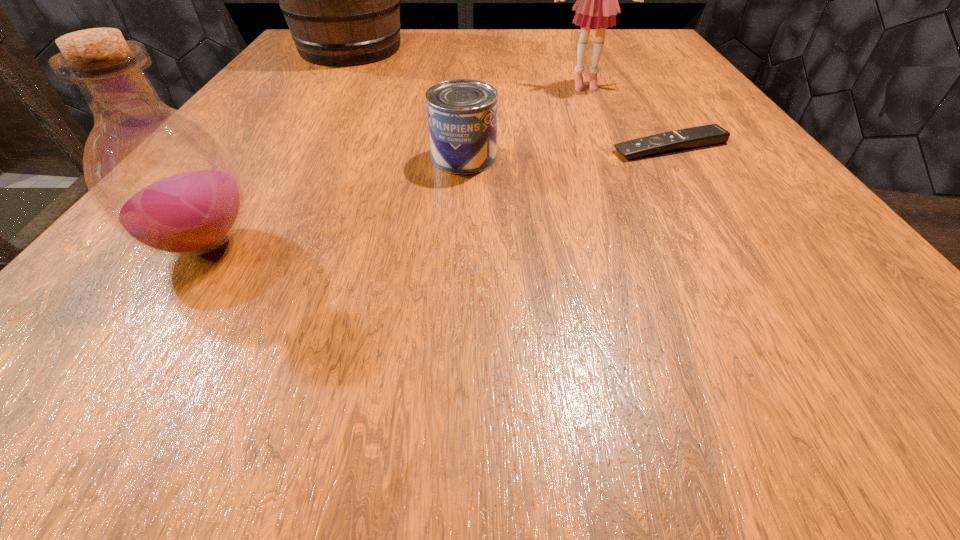
Locate an element on the screen. free region at the far edge of the desktop is located at coordinates (409, 45).

You are a GUI agent. You are given a task and a screenshot of the screen. Output one action in this format:
    pyautogui.click(x=<x>, y=<y>)
    Task: Click on the free point at the near edge
    
    Given the screenshot: What is the action you would take?
    pyautogui.click(x=232, y=384)

At what (x,y) coordinates should I click in order to perform the action: click on vacant space at the left edge. Please return your answer as a coordinate pair (x, y). Looking at the image, I should click on (264, 98).

In the image, there is a desktop. At what (x,y) coordinates should I click in order to perform the action: click on vacant space at the right edge. Please return your answer as a coordinate pair (x, y). Image resolution: width=960 pixels, height=540 pixels. Looking at the image, I should click on (769, 201).

What are the coordinates of `free space at the near right corner of the desktop` in the screenshot? It's located at (857, 328).

Find the location of `vacant space in between the bottle and the tallest object`. vacant space in between the bottle and the tallest object is located at coordinates (277, 147).

At what (x,y) coordinates should I click in order to perform the action: click on vacant space in between the third object from right to left and the farthest object. Please return your answer as a coordinate pair (x, y). Looking at the image, I should click on (407, 103).

You are a GUI agent. You are given a task and a screenshot of the screen. Output one action in this format:
    pyautogui.click(x=<x>, y=<y>)
    Task: Click on the free spot between the bottle and the third object from right to left
    This screenshot has width=960, height=540.
    Given the screenshot: What is the action you would take?
    pyautogui.click(x=334, y=201)

Where is `free spot between the third object from left to right and the third shortest object`? The image size is (960, 540). free spot between the third object from left to right and the third shortest object is located at coordinates (334, 201).

This screenshot has height=540, width=960. Find the location of `free point between the bottle and the second tallest object`. free point between the bottle and the second tallest object is located at coordinates (395, 165).